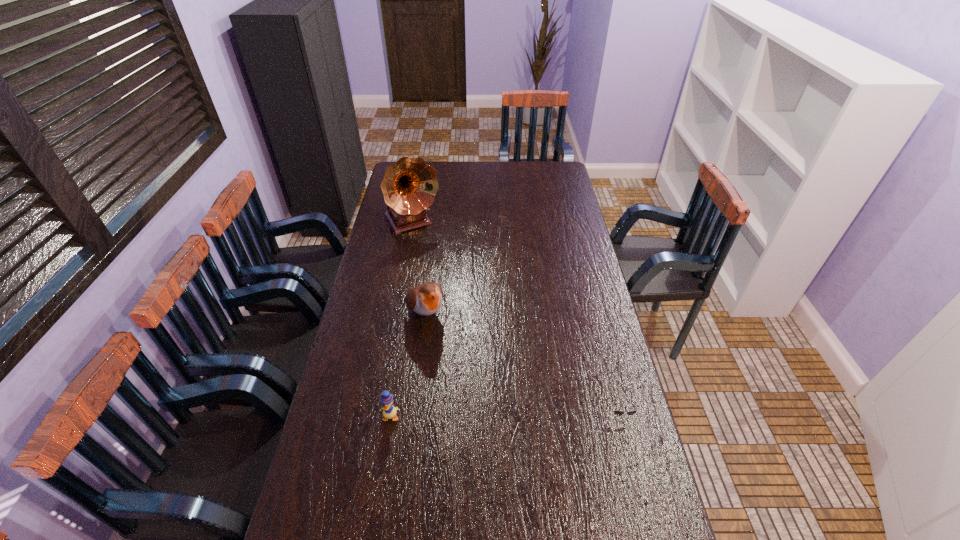
The height and width of the screenshot is (540, 960). I want to click on vacant space that's between the third nearest object and the phonograph_record, so click(x=419, y=268).

Identify the location of vacant area between the farthest object and the bird. (419, 268).

I want to click on empty space between the third nearest object and the sunglasses, so click(522, 363).

Identify the location of the third closest object to the rightmost object. (409, 186).

The width and height of the screenshot is (960, 540). What are the coordinates of `the third closest object to the phonograph_record` in the screenshot? It's located at (617, 412).